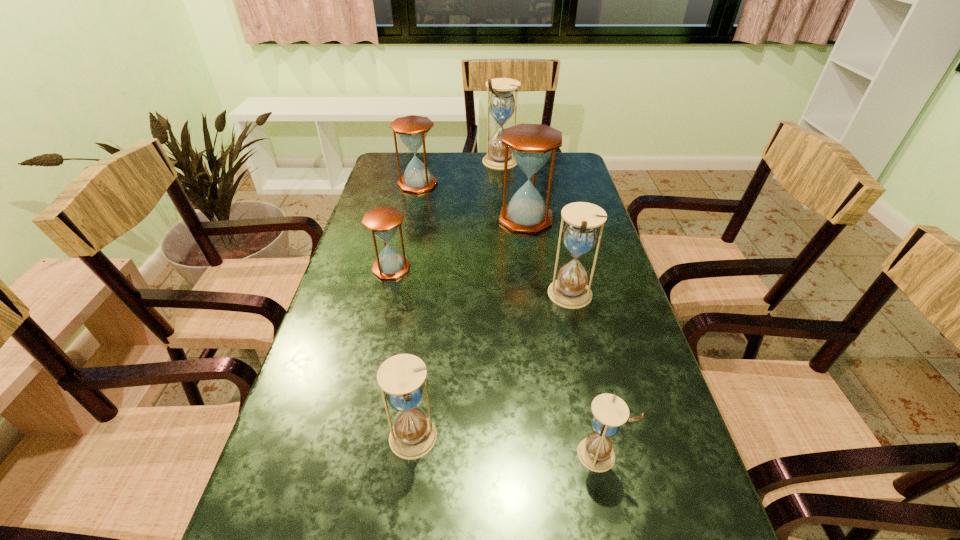
In the image, there is a desktop. What are the coordinates of `vacant space at the right edge` in the screenshot? It's located at (570, 202).

At what (x,y) coordinates should I click in order to perform the action: click on free space at the far left corner of the desktop. Please return your answer as a coordinate pair (x, y). The image size is (960, 540). Looking at the image, I should click on (385, 174).

Locate an element on the screen. free space at the far right corner is located at coordinates (560, 158).

At what (x,y) coordinates should I click in order to perform the action: click on unoccupied position between the third farthest hourglass and the third biggest white hourglass. Please return your answer as a coordinate pair (x, y). This screenshot has height=540, width=960. Looking at the image, I should click on (469, 329).

Locate an element on the screen. The height and width of the screenshot is (540, 960). vacant point located between the third nearest white hourglass and the smallest white hourglass is located at coordinates (585, 375).

The width and height of the screenshot is (960, 540). I want to click on vacant space in between the second biggest white hourglass and the second farthest brown hourglass, so click(x=548, y=257).

Locate an element on the screen. The height and width of the screenshot is (540, 960). free space between the third biggest white hourglass and the third nearest white hourglass is located at coordinates (492, 368).

This screenshot has width=960, height=540. I want to click on free area in between the smallest white hourglass and the second farthest white hourglass, so click(585, 375).

Find the location of `free space between the rightmost brown hourglass and the smallest white hourglass`. free space between the rightmost brown hourglass and the smallest white hourglass is located at coordinates (563, 336).

Where is `object that can be found as the fourth closest to the fifth nearest object`? object that can be found as the fourth closest to the fifth nearest object is located at coordinates (383, 221).